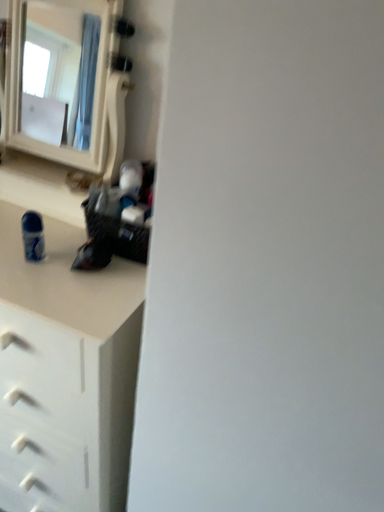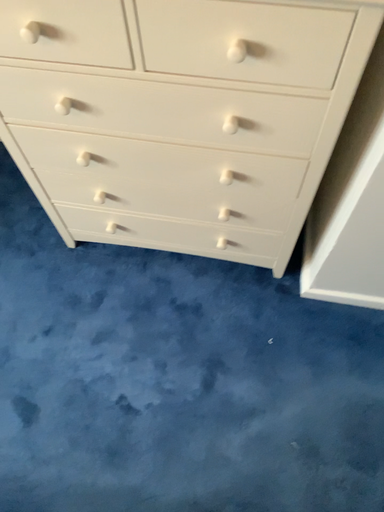
Question: How did the camera likely rotate when shooting the video?

Choices:
 (A) rotated left
 (B) rotated right

Answer: (B)